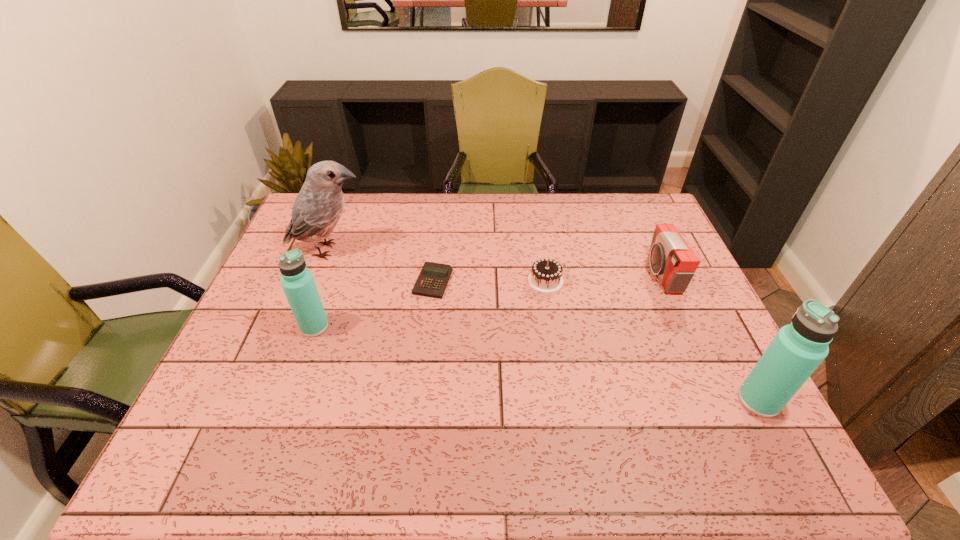
Identify the location of blank region between the shortest object and the chocolate cake. (490, 281).

Where is `empty space between the fourth tallest object and the second nearest object`? empty space between the fourth tallest object and the second nearest object is located at coordinates (488, 300).

Where is `vacant space that is in between the third object from right to left and the third tallest object`? The height and width of the screenshot is (540, 960). vacant space that is in between the third object from right to left and the third tallest object is located at coordinates (430, 303).

In order to click on unoccupied position between the rightmost object and the third object from right to left in this screenshot , I will do `click(652, 341)`.

Locate an element on the screen. empty space that is in between the right thermos bottle and the camera is located at coordinates (709, 337).

I want to click on free spot between the right thermos bottle and the third object from left to right, so click(596, 341).

Find the location of a particular element. empty location between the fourth object from right to left and the fourth shortest object is located at coordinates (373, 304).

The height and width of the screenshot is (540, 960). I want to click on vacant space that's between the parrot and the third shortest object, so click(x=495, y=262).

I want to click on object that can be found as the closest to the parrot, so [x=432, y=281].

Identify which object is the second closest to the chocolate cake. Please provide its 2D coordinates. Your answer should be formatted as a tuple, i.e. [(x, y)], where the tuple contains the x and y coordinates of a point satisfying the conditions above.

[(671, 258)]